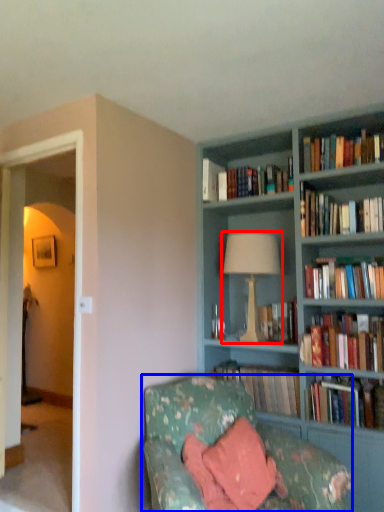
Question: Which point is closer to the camera, table lamp (highlighted by a red box) or studio couch (highlighted by a blue box)?

Choices:
 (A) table lamp
 (B) studio couch

Answer: (B)